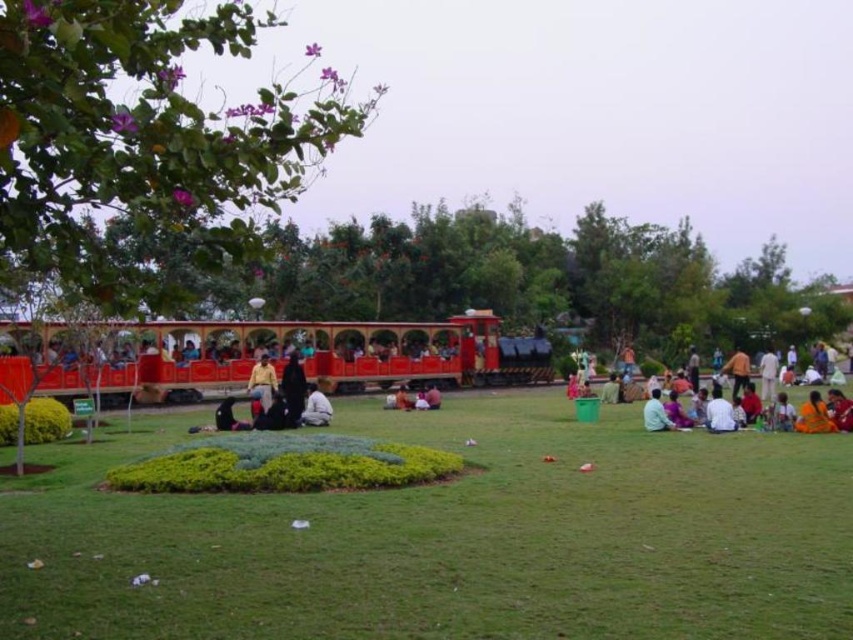
Question: Which is nearer to the green grass at center?

Choices:
 (A) yellow fabric at center
 (B) dark brown fabric at center

Answer: (B)

Question: Does orange fabric person at lower right appear over dark brown fabric at center?

Choices:
 (A) no
 (B) yes

Answer: (B)

Question: Can you confirm if green grass at center is smaller than dark brown fabric at center?

Choices:
 (A) no
 (B) yes

Answer: (A)

Question: Observing the image, what is the correct spatial positioning of yellow fabric at center in reference to light brown fabric shirt at lower right?

Choices:
 (A) above
 (B) below

Answer: (A)

Question: Which object is farther from the camera taking this photo?

Choices:
 (A) white cotton dress at right
 (B) light brown fabric shirt at lower right
 (C) black matte person at center
 (D) white cotton shirt at center

Answer: (D)

Question: Which of these objects is positioned closest to the white cotton dress at right?

Choices:
 (A) orange fabric person at lower right
 (B) light brown fabric shirt at lower right

Answer: (B)